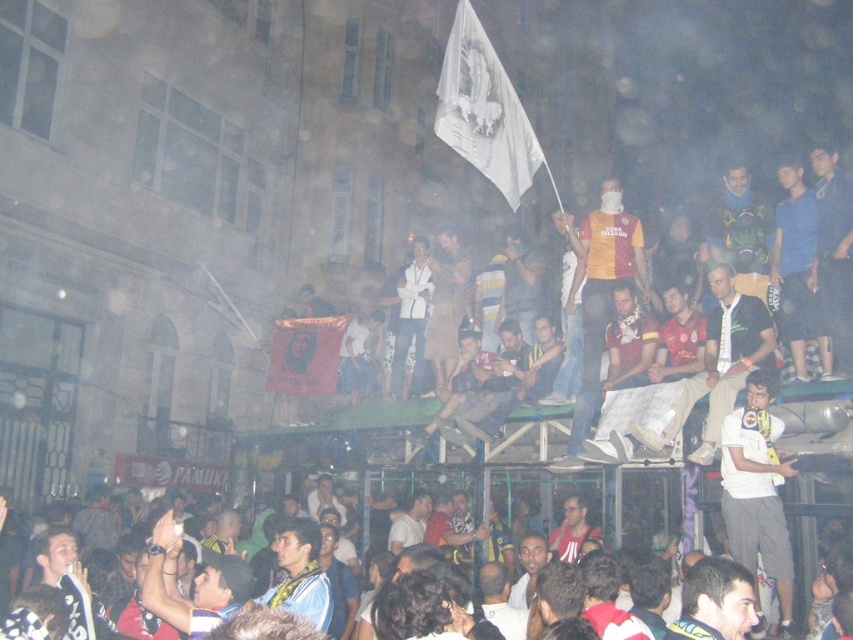
You are a photographer standing at the edge of the crowd in the nighttime scene. You want to capture a photo that includes both the dark brown leather jacket at center and the white shirt at center. Given their distance apart, do you think a standard camera lens with a 50mm focal length will allow you to frame both subjects in the same shot without zooming? Please explain your reasoning.

The dark brown leather jacket at center and white shirt at center are 56.27 feet apart. A standard 50mm lens has a field of view that can typically capture subjects within a 30 to 40 foot distance range when framing two subjects. Since 56.27 feet exceeds this range, the photographer would likely need to use a wider lens or move closer to include both in the frame without zooming.

You are a photographer at the event and want to capture both the red fabric banner at center and the white shirt at center in a single frame. Given that your camera has a fixed focal length and limited field of view, which object should you position closer to the center of the frame to ensure both are fully visible?

Since the red fabric banner at center is wider than the white shirt at center, you should position the red fabric banner at center closer to the center of the frame. This will allow the wider banner to fit within the camera frame while still capturing the white shirt at center in the same shot.